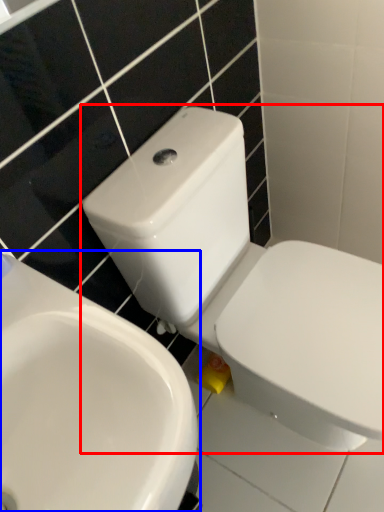
Question: Among these objects, which one is nearest to the camera, toilet (highlighted by a red box) or sink (highlighted by a blue box)?

Choices:
 (A) toilet
 (B) sink

Answer: (B)